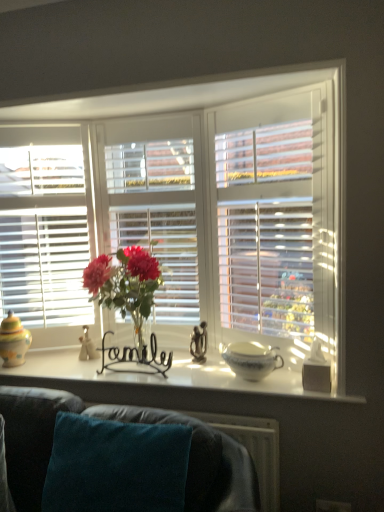
The width and height of the screenshot is (384, 512). Find the location of `white glossy window sill at center`. white glossy window sill at center is located at coordinates (156, 380).

Measure the distance between white glossy window sill at center and camera.

white glossy window sill at center is 5.74 feet from camera.

This screenshot has height=512, width=384. In order to click on multicolored ceramic jar at left, which ranks as the third candle holder in right-to-left order in this screenshot , I will do `click(13, 341)`.

This screenshot has width=384, height=512. What do you see at coordinates (251, 359) in the screenshot?
I see `white ceramic bowl at center` at bounding box center [251, 359].

Identify the location of white glossy window sill at center. (156, 380).

Is white ceramic bowl at center in contact with translucent glass vase at center?

white ceramic bowl at center and translucent glass vase at center are not in contact.

Considering the positions of objects white ceramic bowl at center and translucent glass vase at center in the image provided, who is more to the left, white ceramic bowl at center or translucent glass vase at center?

translucent glass vase at center.

In the image, is white ceramic bowl at center positioned in front of or behind translucent glass vase at center?

white ceramic bowl at center is behind translucent glass vase at center.

Is white ceramic bowl at center surrounding translucent glass vase at center?

No, translucent glass vase at center is not a part of white ceramic bowl at center.

Are translucent glass vase at center and white matte tissue box at right, which ranks as the 3th candle holder in back-to-front order, beside each other?

No, translucent glass vase at center is not with white matte tissue box at right, which ranks as the 3th candle holder in back-to-front order.

Which point is more forward, [132,282] or [325,386]?

The point [325,386] is closer.

Is white matte tissue box at right, the first candle holder positioned from the right, completely or partially inside translucent glass vase at center?

No, white matte tissue box at right, the first candle holder positioned from the right, is not a part of translucent glass vase at center.

Can you tell me how much multicolored ceramic jar at left, which ranks as the third candle holder in right-to-left order, and translucent glass vase at center differ in facing direction?

The facing directions of multicolored ceramic jar at left, which ranks as the third candle holder in right-to-left order, and translucent glass vase at center are 2.71 degrees apart.

From the image's perspective, which is above, multicolored ceramic jar at left, the 1th candle holder from the left, or translucent glass vase at center?

From the image's view, translucent glass vase at center is above.

Relative to translucent glass vase at center, is multicolored ceramic jar at left, the 1th candle holder from the left, in front or behind?

Visually, multicolored ceramic jar at left, the 1th candle holder from the left, is located behind translucent glass vase at center.

Could you tell me if multicolored ceramic jar at left, which is the 3th candle holder in front-to-back order, is facing translucent glass vase at center?

No.

Is white ceramic bowl at center spatially inside black wire at center, the 2th candle holder when ordered from left to right, or outside of it?

white ceramic bowl at center is located beyond the bounds of black wire at center, the 2th candle holder when ordered from left to right.

Is white ceramic bowl at center to the left of black wire at center, the 2th candle holder when ordered from left to right, from the viewer's perspective?

No.

Is there a large distance between white ceramic bowl at center and black wire at center, which is the second candle holder from front to back?

white ceramic bowl at center is near black wire at center, which is the second candle holder from front to back, not far away.

Is white ceramic bowl at center at the right side of white glossy window sill at center?

Yes.

Locate an element on the screen. This screenshot has height=512, width=384. glass bowl on the right side of white glossy window sill at center is located at coordinates (251, 359).

Considering the relative positions of white ceramic bowl at center and white glossy window sill at center in the image provided, is white ceramic bowl at center behind white glossy window sill at center?

Yes, white ceramic bowl at center is further from the camera.

Considering the sizes of white ceramic bowl at center and white glossy window sill at center in the image, is white ceramic bowl at center taller or shorter than white glossy window sill at center?

white ceramic bowl at center is taller than white glossy window sill at center.

Which object is positioned more to the right, white glossy window sill at center or white matte tissue box at right, placed as the 3th candle holder when sorted from left to right?

From the viewer's perspective, white matte tissue box at right, placed as the 3th candle holder when sorted from left to right, appears more on the right side.

From the image's perspective, is white glossy window sill at center on white matte tissue box at right, placed as the 3th candle holder when sorted from left to right?

No.

Is white glossy window sill at center taller or shorter than white matte tissue box at right, which ranks as the 3th candle holder in back-to-front order?

In the image, white glossy window sill at center appears to be shorter than white matte tissue box at right, which ranks as the 3th candle holder in back-to-front order.

Does white glossy window sill at center touch white matte tissue box at right, the first candle holder positioned from the right?

They are not placed beside each other.

Based on the photo, is white ceramic bowl at center facing towards teal fabric couch at lower center?

Yes, white ceramic bowl at center is turned towards teal fabric couch at lower center.

From the image's perspective, between white ceramic bowl at center and teal fabric couch at lower center, who is located below?

From the image's view, teal fabric couch at lower center is below.

In the scene shown: Is the surface of white ceramic bowl at center in direct contact with teal fabric couch at lower center?

No, white ceramic bowl at center is not beside teal fabric couch at lower center.

The width and height of the screenshot is (384, 512). What are the coordinates of `studio couch on the left of white ceramic bowl at center` in the screenshot? It's located at (203, 461).

You are a GUI agent. You are given a task and a screenshot of the screen. Output one action in this format:
    pyautogui.click(x=<x>, y=<y>)
    Task: Click on the floral arrangement on the left of white ceramic bowl at center
    The width and height of the screenshot is (384, 512).
    Given the screenshot: What is the action you would take?
    pyautogui.click(x=125, y=284)

Locate an element on the screen. This screenshot has height=512, width=384. the 3rd candle holder positioned below the translucent glass vase at center (from a real-world perspective) is located at coordinates pyautogui.click(x=316, y=370).

Based on their spatial positions, is white wooden blinds at center or white glossy window sill at center further from teal fabric couch at lower center?

white wooden blinds at center.

From the image, which object appears to be farther from white glossy window sill at center, multicolored ceramic jar at left, which is the 3th candle holder in front-to-back order, or white matte tissue box at right, the first candle holder positioned from the right?

Among the two, white matte tissue box at right, the first candle holder positioned from the right, is located further to white glossy window sill at center.

Looking at the image, which one is located closer to multicolored ceramic jar at left, the 1th candle holder from the left, white matte tissue box at right, which ranks as the 3th candle holder in back-to-front order, or translucent glass vase at center?

translucent glass vase at center is closer to multicolored ceramic jar at left, the 1th candle holder from the left.

Considering their positions, is translucent glass vase at center positioned further to white wooden blinds at center than white glossy window sill at center?

white glossy window sill at center is positioned further to the anchor white wooden blinds at center.

When comparing their distances from white matte tissue box at right, which ranks as the 3th candle holder in back-to-front order, does multicolored ceramic jar at left, which ranks as the third candle holder in right-to-left order, or white glossy window sill at center seem closer?

white glossy window sill at center is positioned closer to the anchor white matte tissue box at right, which ranks as the 3th candle holder in back-to-front order.

From the image, which object appears to be farther from black wire at center, the 2th candle holder when ordered from left to right, multicolored ceramic jar at left, which is the 3th candle holder in front-to-back order, or teal fabric couch at lower center?

teal fabric couch at lower center is further to black wire at center, the 2th candle holder when ordered from left to right.

Which object lies nearer to the anchor point white wooden blinds at center, white matte tissue box at right, placed as the 3th candle holder when sorted from left to right, or teal fabric couch at lower center?

The object closer to white wooden blinds at center is white matte tissue box at right, placed as the 3th candle holder when sorted from left to right.

Considering their positions, is white wooden blinds at center positioned closer to white glossy window sill at center than white matte tissue box at right, which ranks as the 3th candle holder in back-to-front order?

white wooden blinds at center is closer to white glossy window sill at center.

This screenshot has height=512, width=384. I want to click on window situated between translucent glass vase at center and white ceramic bowl at center from left to right, so click(x=207, y=211).

Locate an element on the screen. candle holder located between teal fabric couch at lower center and translucent glass vase at center in the depth direction is located at coordinates (316, 370).

You are a GUI agent. You are given a task and a screenshot of the screen. Output one action in this format:
    pyautogui.click(x=<x>, y=<y>)
    Task: Click on the window located between teal fabric couch at lower center and white ceramic bowl at center in the depth direction
    
    Given the screenshot: What is the action you would take?
    pyautogui.click(x=207, y=211)

The height and width of the screenshot is (512, 384). I want to click on glass bowl situated between white glossy window sill at center and white matte tissue box at right, placed as the 3th candle holder when sorted from left to right, from left to right, so click(251, 359).